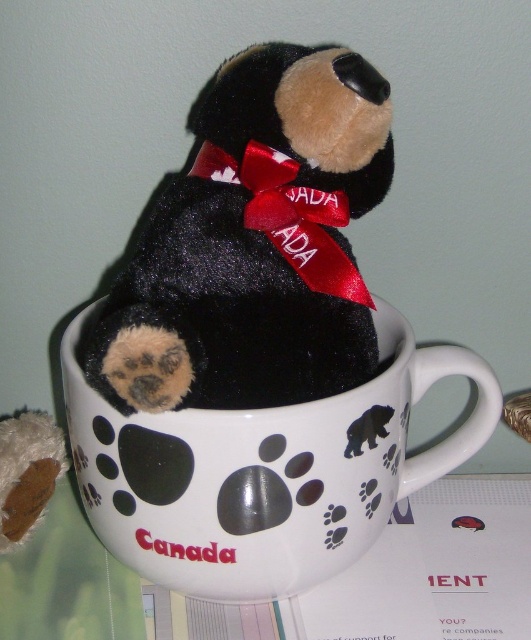
Question: Can you confirm if black plush bear at center is bigger than white glossy mug at center?

Choices:
 (A) yes
 (B) no

Answer: (B)

Question: Does black plush bear at center appear over white glossy mug at center?

Choices:
 (A) yes
 (B) no

Answer: (A)

Question: Which point is farther to the camera?

Choices:
 (A) white glossy mug at center
 (B) black plush bear at center

Answer: (A)

Question: Does black plush bear at center come in front of white glossy mug at center?

Choices:
 (A) yes
 (B) no

Answer: (A)